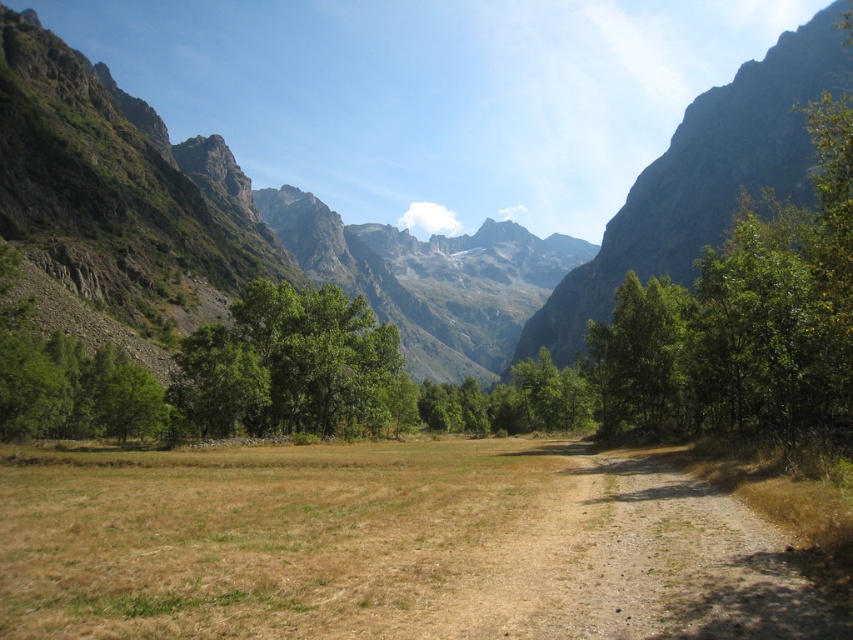
Question: Which point is farther to the camera?

Choices:
 (A) rugged rock mountain at upper right
 (B) rocky gray mountain at center

Answer: (A)

Question: Can you confirm if rocky gray mountain at center is positioned above rugged rock mountain at upper right?

Choices:
 (A) yes
 (B) no

Answer: (A)

Question: Is rocky gray mountain at center to the right of rugged rock mountain at upper right from the viewer's perspective?

Choices:
 (A) no
 (B) yes

Answer: (A)

Question: Which object appears closest to the camera in this image?

Choices:
 (A) rocky gray mountain at center
 (B) rugged rock mountain at upper right

Answer: (A)

Question: From the image, what is the correct spatial relationship of rocky gray mountain at center in relation to rugged rock mountain at upper right?

Choices:
 (A) above
 (B) below

Answer: (A)